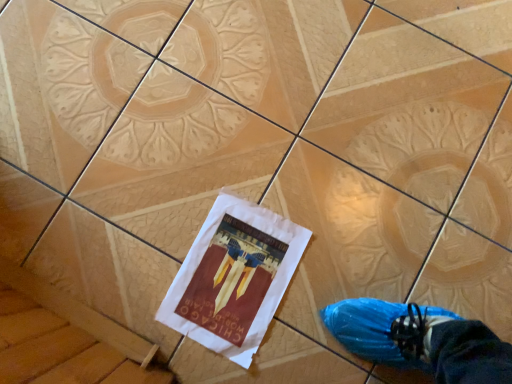
Identify the location of vacant space underneath white paper postcard at lower left (from a real-world perspective). (234, 273).